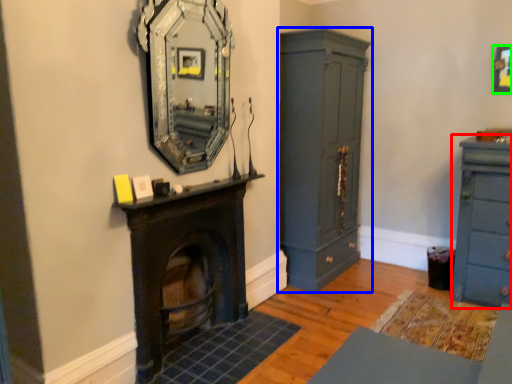
Question: Based on their relative distances, which object is nearer to chest of drawers (highlighted by a red box)? Choose from cupboard (highlighted by a blue box) and picture frame (highlighted by a green box).

Choices:
 (A) cupboard
 (B) picture frame

Answer: (B)